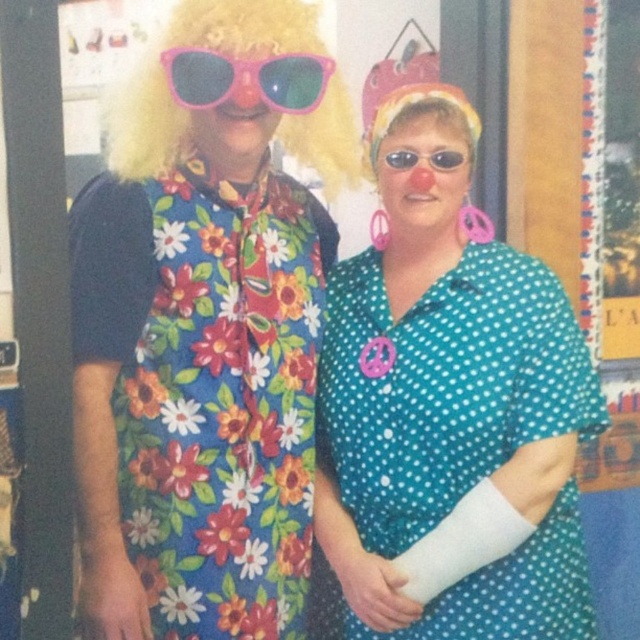
Question: Which object appears farthest from the camera in this image?

Choices:
 (A) fluffy blonde wig at upper left
 (B) teal polka dot dress at center

Answer: (B)

Question: Does floral fabric dress at left appear over pink plastic sunglasses at upper center?

Choices:
 (A) no
 (B) yes

Answer: (A)

Question: Does floral fabric dress at left have a lesser width compared to fluffy blonde wig at upper left?

Choices:
 (A) yes
 (B) no

Answer: (A)

Question: Which point is farther from the camera taking this photo?

Choices:
 (A) (211, 227)
 (B) (556, 576)
 (C) (349, 108)

Answer: (C)

Question: Where is fluffy blonde wig at upper left located in relation to pink plastic sunglasses at upper center in the image?

Choices:
 (A) left
 (B) right

Answer: (A)

Question: Which object appears farthest from the camera in this image?

Choices:
 (A) teal polka dot dress at center
 (B) pink plastic sunglasses at upper center

Answer: (A)